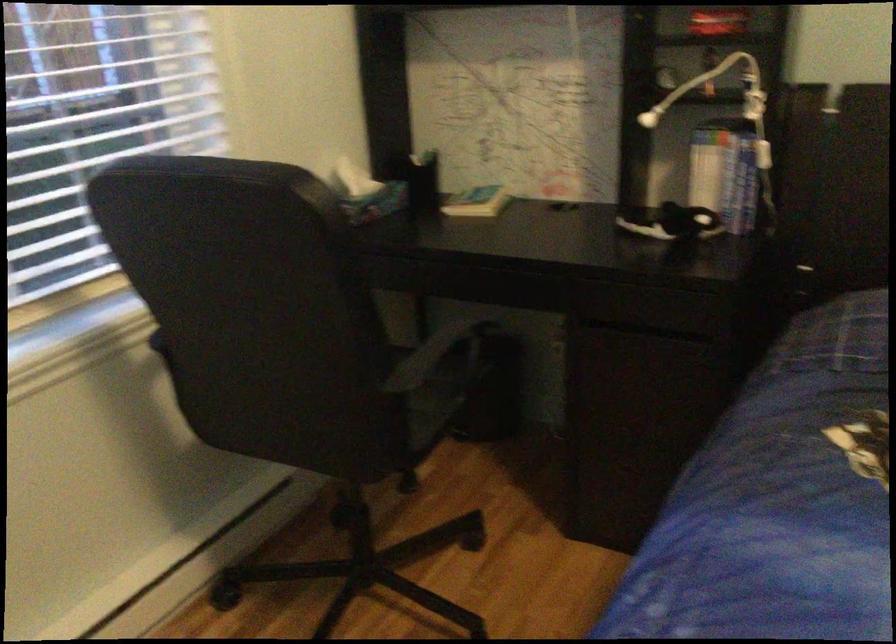
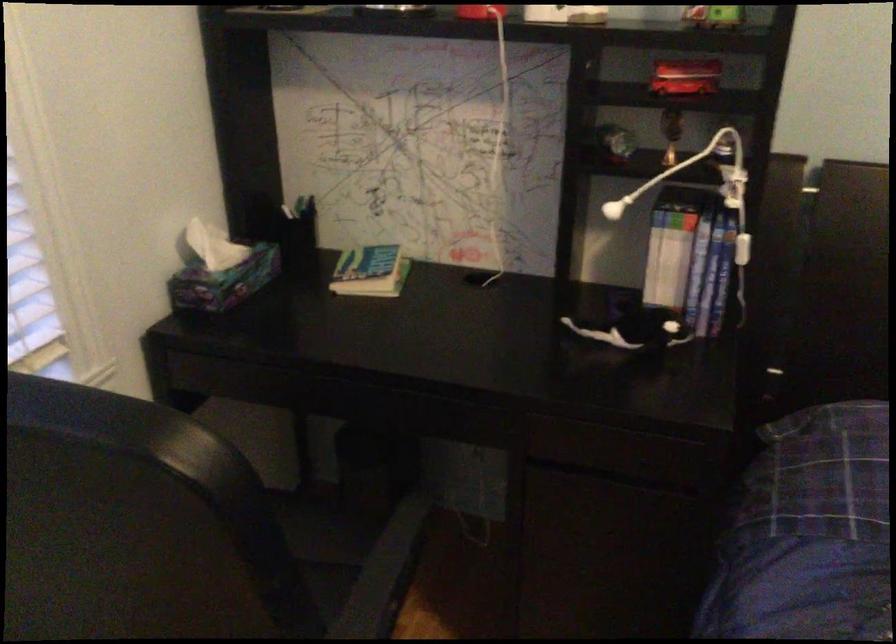
The point at (474,196) is marked in the first image. Where is the corresponding point in the second image?

(371, 270)